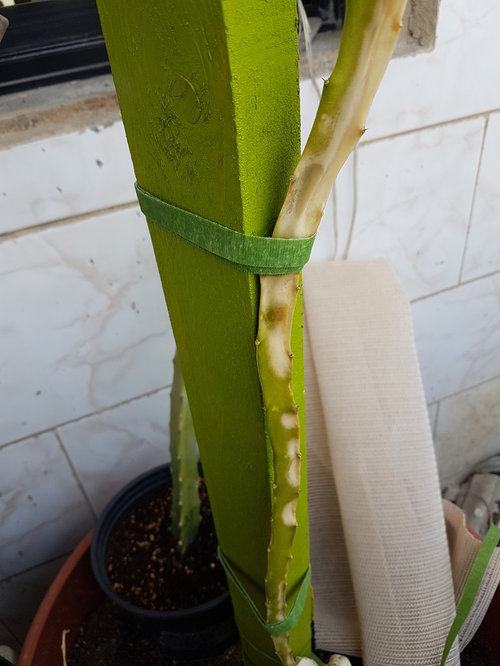
Find the location of a particular element. 2 edges of flower pots is located at coordinates (55, 603), (158, 623).